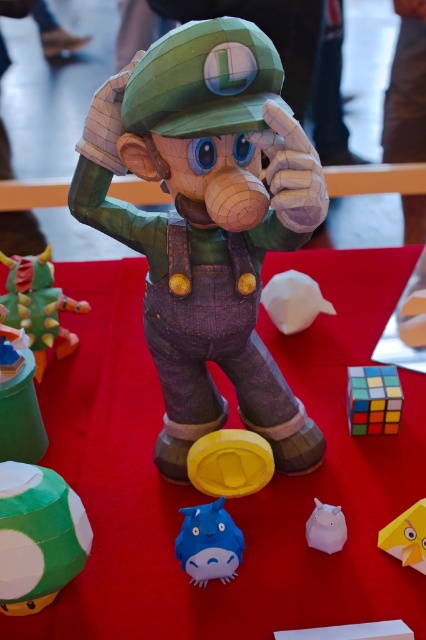
You are a toy designer who wants to place a new toy between the blue matte plush toy at center and the yellow paper toy at center. The new toy is 10 centimeters wide. Will there be enough space between them to fit the new toy?

The blue matte plush toy at center is 20.15 centimeters from the yellow paper toy at center. Since the new toy is 10 centimeters wide, there is sufficient space between them to accommodate it.

You are standing in front of the paper models displayed on the red surface. You notice two points marked as point 1 and point 2. Point 1 is located at coordinate (39,365) and point 2 is at (336,529). Which point is closer to you?

Point 1 is closer to you because it is further to the camera than point 2.